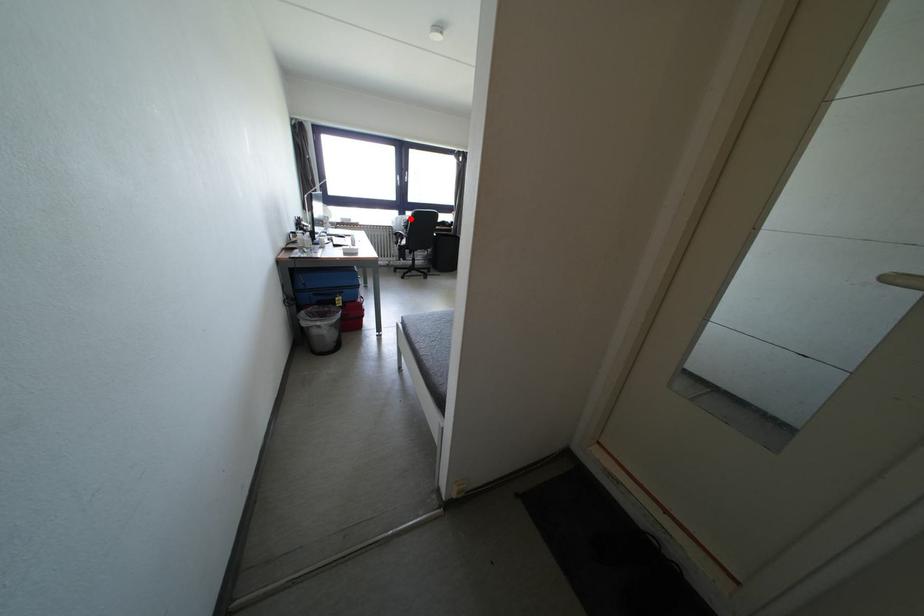
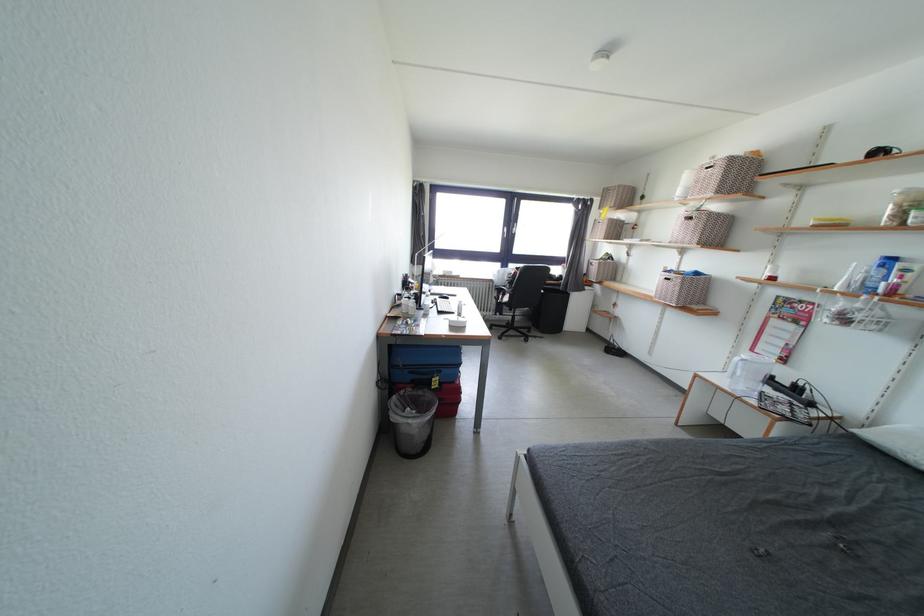
Question: A red point is marked in image1. In image2, is the corresponding 3D point closer to the camera or farther? Reply with the corresponding letter.

Choices:
 (A) The corresponding 3D point is closer.
 (B) The corresponding 3D point is farther.

Answer: (B)